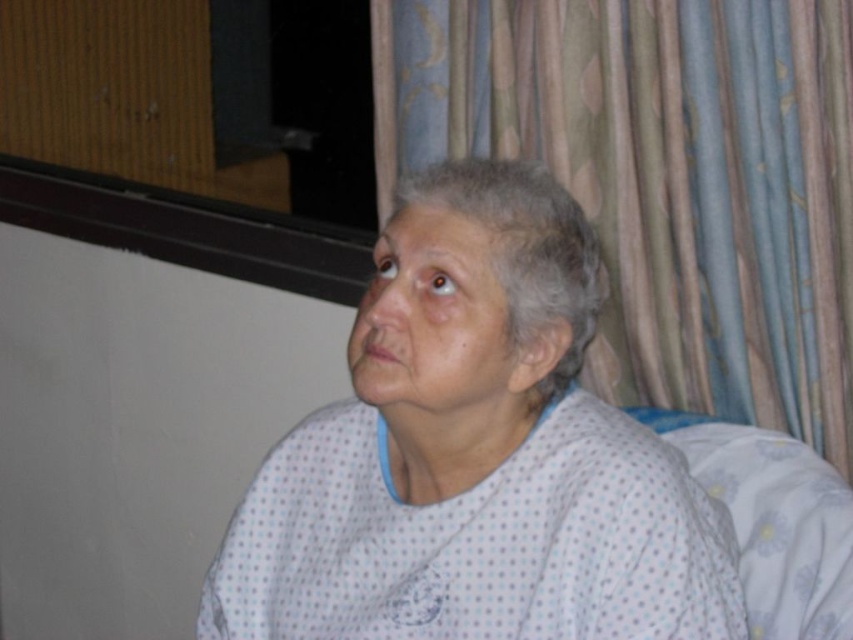
Question: Which of the following is the closest to the observer?

Choices:
 (A) click(x=460, y=515)
 (B) click(x=759, y=406)

Answer: (A)

Question: Can you confirm if white dotted fabric at center is thinner than blue textured curtain at upper right?

Choices:
 (A) yes
 (B) no

Answer: (A)

Question: Does white dotted fabric at center have a larger size compared to blue textured curtain at upper right?

Choices:
 (A) no
 (B) yes

Answer: (A)

Question: Does white dotted fabric at center come in front of blue textured curtain at upper right?

Choices:
 (A) no
 (B) yes

Answer: (B)

Question: Among these points, which one is nearest to the camera?

Choices:
 (A) (692, 186)
 (B) (399, 429)

Answer: (B)